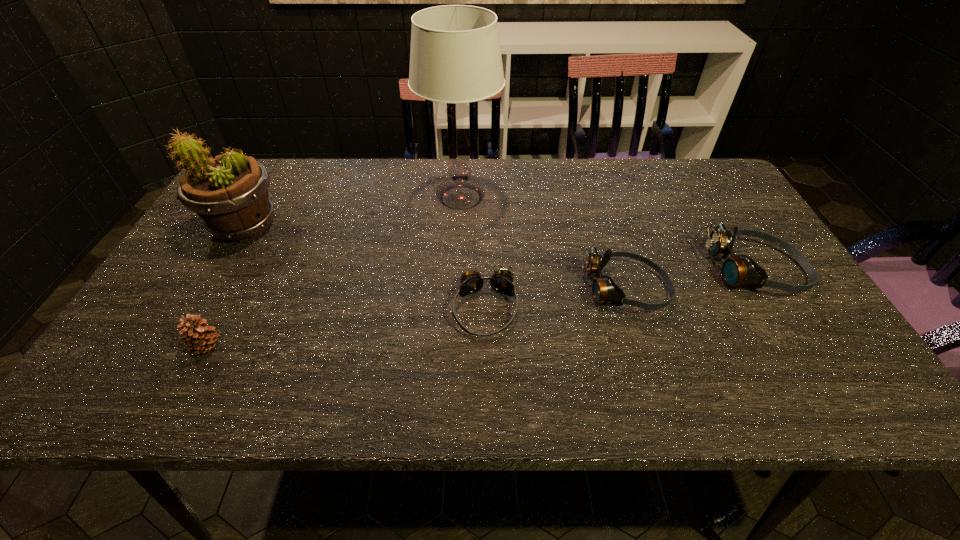
The height and width of the screenshot is (540, 960). In order to click on object present at the near left corner in this screenshot , I will do `click(199, 337)`.

You are a GUI agent. You are given a task and a screenshot of the screen. Output one action in this format:
    pyautogui.click(x=<x>, y=<y>)
    Task: Click on the free space at the far edge of the desktop
    
    Given the screenshot: What is the action you would take?
    pyautogui.click(x=554, y=160)

At what (x,y) coordinates should I click in order to perform the action: click on vacant space at the near edge of the desktop. Please return your answer as a coordinate pair (x, y). The image size is (960, 540). Looking at the image, I should click on (486, 343).

In order to click on blank space at the left edge in this screenshot , I will do `click(228, 246)`.

Where is `vacant region at the right edge of the desktop`? The height and width of the screenshot is (540, 960). vacant region at the right edge of the desktop is located at coordinates (754, 310).

Find the location of a particular element. free location at the far left corner of the desktop is located at coordinates (278, 172).

This screenshot has height=540, width=960. Identify the location of vacant area at the near left corner of the desktop. (176, 341).

I want to click on free space that is in between the second shortest goggles and the fifth shortest object, so click(435, 258).

The image size is (960, 540). I want to click on free space between the table lamp and the second object from right to left, so click(543, 244).

This screenshot has height=540, width=960. I want to click on vacant area between the rightmost object and the table lamp, so click(609, 234).